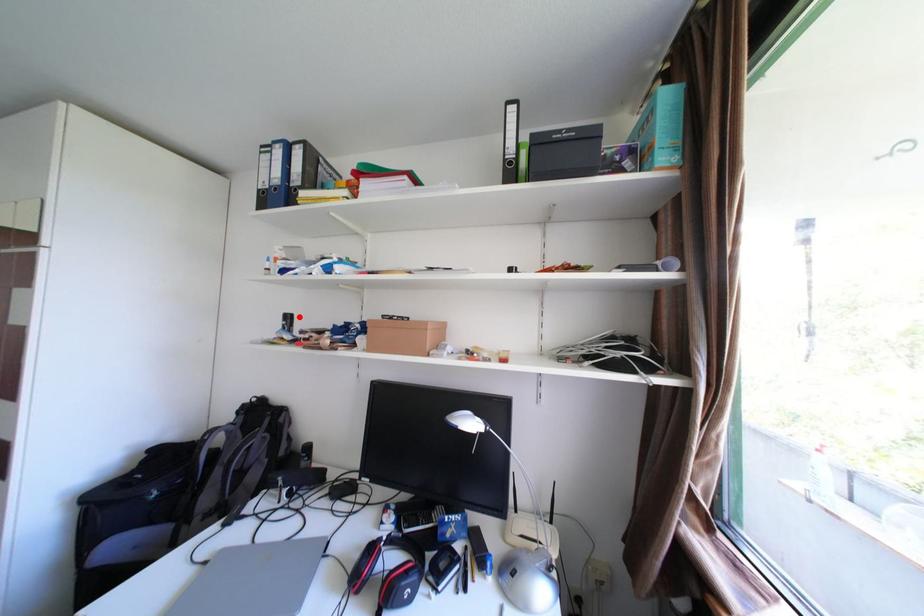
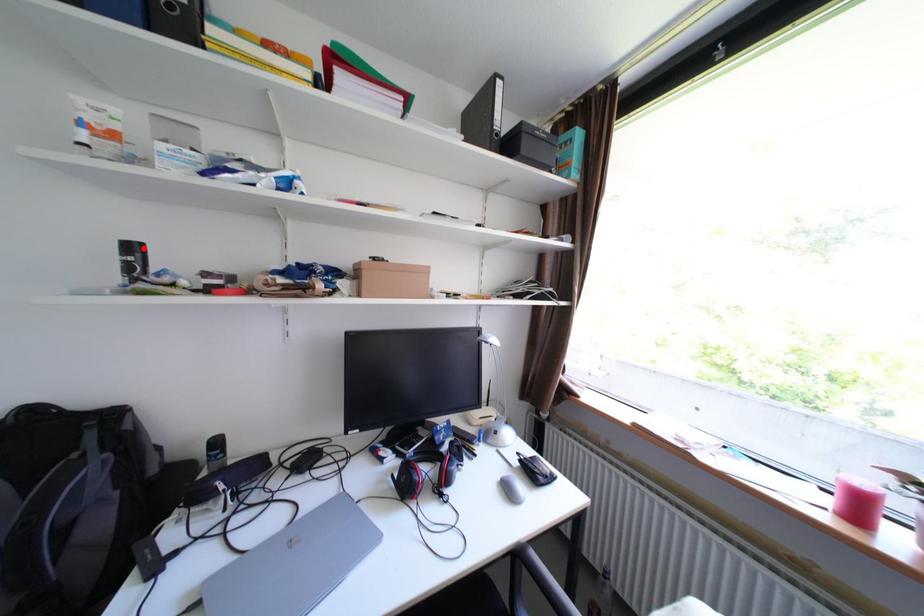
I am providing you with two images of the same scene from different viewpoints. A red point is marked on the first image and another point is marked on the second image. Is the marked point in image1 the same physical position as the marked point in image2?

Yes